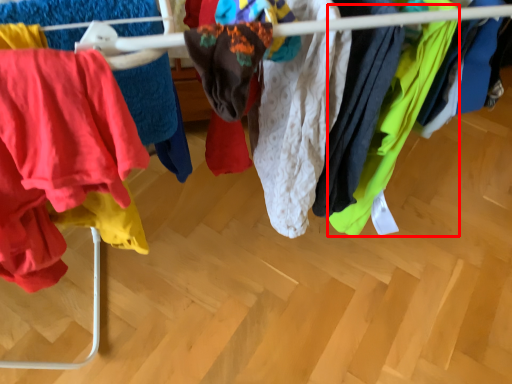
Question: From the image's perspective, where is clothing (annotated by the red box) located relative to clothing?

Choices:
 (A) above
 (B) below

Answer: (B)